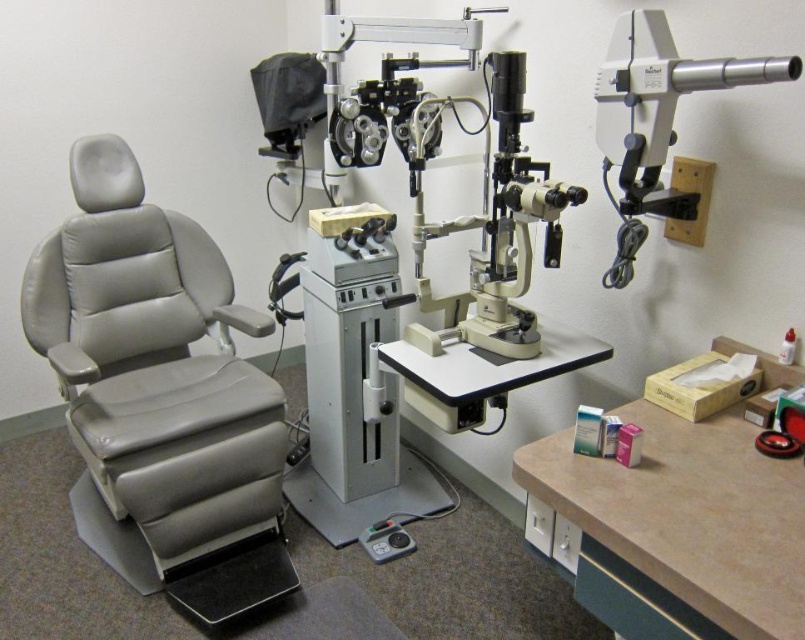
Between gray leather swivel chair at left and beige laminate table at lower right, which one appears on the left side from the viewer's perspective?

gray leather swivel chair at left

Can you confirm if gray leather swivel chair at left is shorter than beige laminate table at lower right?

No.

The height and width of the screenshot is (640, 805). I want to click on gray leather swivel chair at left, so click(x=159, y=394).

Is gray leather swivel chair at left further to camera compared to white plastic telescope at upper right?

Yes, it is.

Describe the element at coordinates (159, 394) in the screenshot. I see `gray leather swivel chair at left` at that location.

Who is more distant from viewer, (x=242, y=547) or (x=698, y=76)?

Point (x=242, y=547)

You are a GUI agent. You are given a task and a screenshot of the screen. Output one action in this format:
    pyautogui.click(x=<x>, y=<y>)
    Task: Click on the gray leather swivel chair at left
    
    Given the screenshot: What is the action you would take?
    pyautogui.click(x=159, y=394)

Between beige laminate table at lower right and white plastic telescope at upper right, which one is positioned higher?

Positioned higher is white plastic telescope at upper right.

Who is more distant from viewer, (696, 435) or (634, 90)?

The point (634, 90) is more distant.

Does point (651, 486) come in front of point (663, 90)?

Yes, point (651, 486) is closer to viewer.

Where is `beige laminate table at lower right`? beige laminate table at lower right is located at coordinates (680, 528).